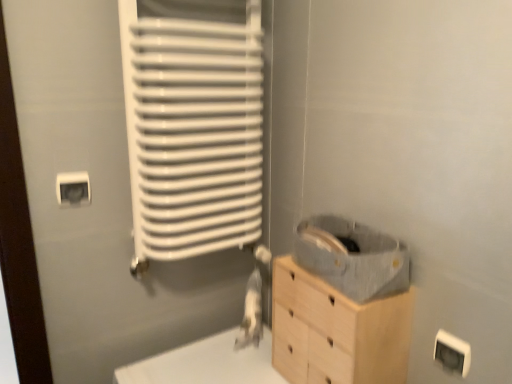
Question: Does white plastic electric outlet at upper left, the first electric outlet positioned from the left, appear on the left side of white plastic electric outlet at lower right, which ranks as the first electric outlet in bottom-to-top order?

Choices:
 (A) yes
 (B) no

Answer: (A)

Question: Is white plastic electric outlet at upper left, which ranks as the second electric outlet in bottom-to-top order, thinner than white plastic electric outlet at lower right, the 2th electric outlet when ordered from back to front?

Choices:
 (A) yes
 (B) no

Answer: (A)

Question: Are white plastic electric outlet at upper left, which appears as the second electric outlet when viewed from the right, and white plastic electric outlet at lower right, which ranks as the first electric outlet in bottom-to-top order, far apart?

Choices:
 (A) no
 (B) yes

Answer: (A)

Question: Can you confirm if white plastic electric outlet at upper left, the first electric outlet positioned from the left, is wider than white plastic electric outlet at lower right, the 2th electric outlet when ordered from back to front?

Choices:
 (A) no
 (B) yes

Answer: (A)

Question: Does white plastic electric outlet at upper left, acting as the first electric outlet starting from the back, contain white plastic electric outlet at lower right, positioned as the first electric outlet in front-to-back order?

Choices:
 (A) no
 (B) yes

Answer: (A)

Question: Can you confirm if white plastic electric outlet at upper left, which ranks as the second electric outlet in bottom-to-top order, is shorter than white plastic electric outlet at lower right, which appears as the 2th electric outlet when viewed from the top?

Choices:
 (A) yes
 (B) no

Answer: (A)

Question: Considering the relative sizes of white plastic electric outlet at upper left, the 2th electric outlet from the front, and white matte radiator at left in the image provided, is white plastic electric outlet at upper left, the 2th electric outlet from the front, wider than white matte radiator at left?

Choices:
 (A) yes
 (B) no

Answer: (B)

Question: Could you tell me if white plastic electric outlet at upper left, which is the 1th electric outlet from top to bottom, is facing white matte radiator at left?

Choices:
 (A) no
 (B) yes

Answer: (A)

Question: From the image's perspective, is white plastic electric outlet at upper left, acting as the first electric outlet starting from the back, located beneath white matte radiator at left?

Choices:
 (A) yes
 (B) no

Answer: (A)

Question: Does white plastic electric outlet at upper left, the first electric outlet positioned from the left, have a larger size compared to white matte radiator at left?

Choices:
 (A) no
 (B) yes

Answer: (A)

Question: Does white plastic electric outlet at upper left, the 2th electric outlet from the front, have a lesser width compared to white matte radiator at left?

Choices:
 (A) yes
 (B) no

Answer: (A)

Question: From the image's perspective, is white plastic electric outlet at upper left, acting as the first electric outlet starting from the back, on top of white matte radiator at left?

Choices:
 (A) no
 (B) yes

Answer: (A)

Question: From a real-world perspective, is light wood chest of drawers at lower right located beneath white matte radiator at left?

Choices:
 (A) yes
 (B) no

Answer: (A)